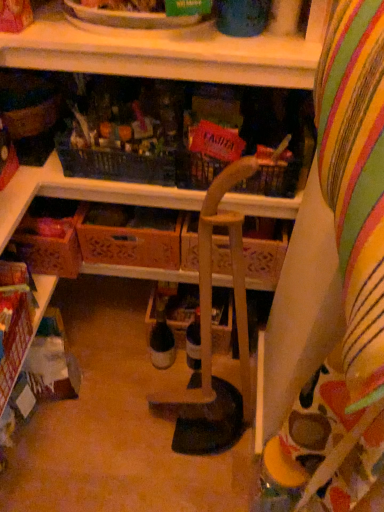
This screenshot has width=384, height=512. I want to click on vacant region below wooden crate at lower left, which is counted as the second shelf, starting from the right (from a real-world perspective), so click(x=46, y=440).